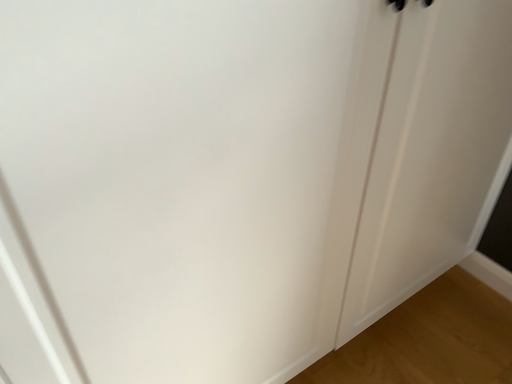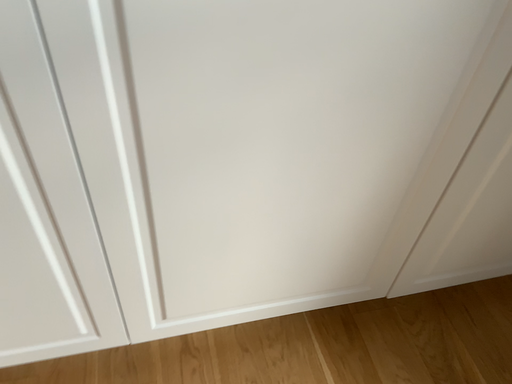
Question: Which way did the camera rotate in the video?

Choices:
 (A) rotated left
 (B) rotated right

Answer: (A)